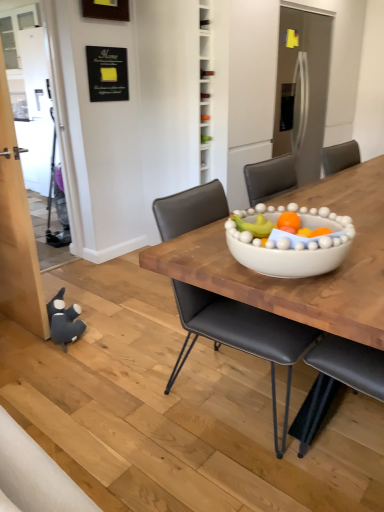
Question: Should I look upward or downward to see dark gray plush toy at lower left?

Choices:
 (A) up
 (B) down

Answer: (B)

Question: Is dark gray plush toy at lower left to the right of black leather chair at center from the viewer's perspective?

Choices:
 (A) no
 (B) yes

Answer: (A)

Question: Can you see dark gray plush toy at lower left touching black leather chair at center?

Choices:
 (A) no
 (B) yes

Answer: (A)

Question: Is dark gray plush toy at lower left wider than black leather chair at center?

Choices:
 (A) yes
 (B) no

Answer: (B)

Question: From a real-world perspective, is dark gray plush toy at lower left on black leather chair at center?

Choices:
 (A) no
 (B) yes

Answer: (A)

Question: Can you confirm if dark gray plush toy at lower left is taller than black leather chair at center?

Choices:
 (A) yes
 (B) no

Answer: (B)

Question: From the image's perspective, does dark gray plush toy at lower left appear lower than black leather chair at center?

Choices:
 (A) yes
 (B) no

Answer: (A)

Question: Is black leather chair at center wider than dark gray plush toy at lower left?

Choices:
 (A) no
 (B) yes

Answer: (B)

Question: Is black leather chair at center bigger than dark gray plush toy at lower left?

Choices:
 (A) no
 (B) yes

Answer: (B)

Question: From a real-world perspective, is black leather chair at center under dark gray plush toy at lower left?

Choices:
 (A) no
 (B) yes

Answer: (A)

Question: Is black leather chair at center oriented away from dark gray plush toy at lower left?

Choices:
 (A) no
 (B) yes

Answer: (B)

Question: Is dark gray plush toy at lower left completely or partially inside black leather chair at center?

Choices:
 (A) yes
 (B) no

Answer: (B)

Question: Considering the relative sizes of black leather chair at center and dark gray plush toy at lower left in the image provided, is black leather chair at center thinner than dark gray plush toy at lower left?

Choices:
 (A) yes
 (B) no

Answer: (B)

Question: Does point (61, 326) appear closer or farther from the camera than point (236, 348)?

Choices:
 (A) closer
 (B) farther

Answer: (B)